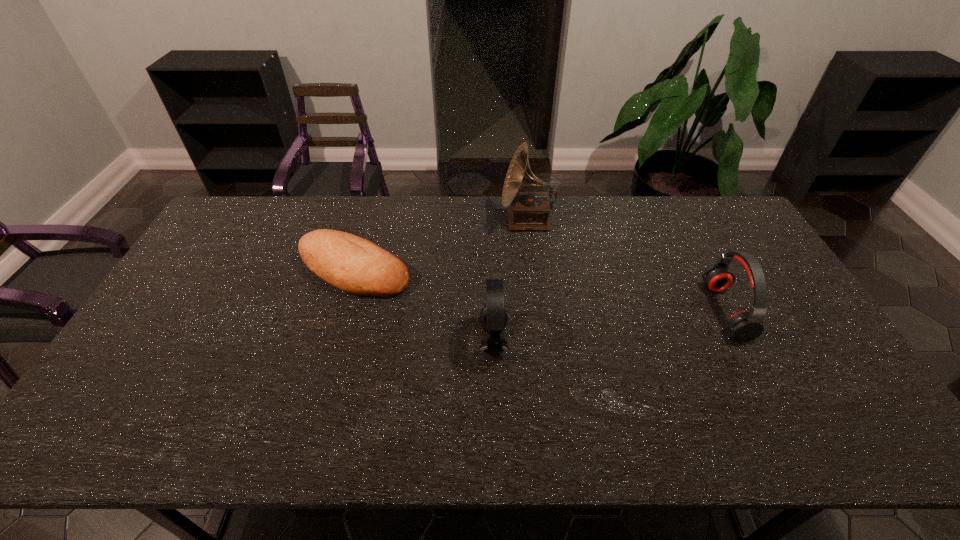
At what (x,y) coordinates should I click in order to perform the action: click on vacant space at the far left corner of the desktop. Please return your answer as a coordinate pair (x, y). The height and width of the screenshot is (540, 960). Looking at the image, I should click on tap(247, 211).

Locate an element on the screen. vacant space at the near right corner is located at coordinates pos(885,436).

This screenshot has width=960, height=540. I want to click on vacant area that lies between the farthest object and the shortest object, so click(441, 246).

Find the location of `unoccupied area between the leftmost object and the second object from right to left`. unoccupied area between the leftmost object and the second object from right to left is located at coordinates (441, 246).

The width and height of the screenshot is (960, 540). What are the coordinates of `free spot between the second object from left to right and the rightmost object` in the screenshot? It's located at (610, 326).

Find the location of a particular element. The width and height of the screenshot is (960, 540). free space that is in between the rightmost object and the leftmost object is located at coordinates (540, 291).

At what (x,y) coordinates should I click in order to perform the action: click on vacant space that is in between the left earphone and the right earphone. Please return your answer as a coordinate pair (x, y). The height and width of the screenshot is (540, 960). Looking at the image, I should click on (610, 326).

I want to click on unoccupied position between the bread and the phonograph record, so click(441, 246).

Identify the location of free spot between the bread and the phonograph record. Image resolution: width=960 pixels, height=540 pixels. (441, 246).

Where is `free spot between the right earphone and the third object from right to left`? The height and width of the screenshot is (540, 960). free spot between the right earphone and the third object from right to left is located at coordinates (610, 326).